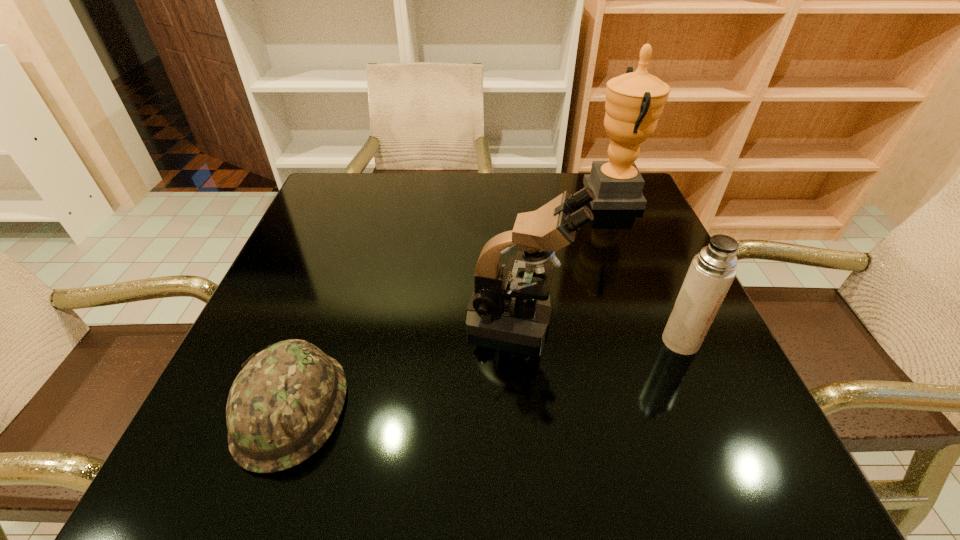
Locate an element on the screen. vacant space situated 0.060m on the front of the third shortest object is located at coordinates (524, 375).

In order to click on free space located 0.250m on the left of the thermos bottle in this screenshot , I will do `click(527, 341)`.

This screenshot has width=960, height=540. What are the coordinates of `vacant space situated on the left of the shortest object` in the screenshot? It's located at (205, 409).

This screenshot has height=540, width=960. I want to click on object at the far edge, so click(x=634, y=101).

This screenshot has width=960, height=540. Identify the location of object that is at the near edge. (284, 404).

Locate an element on the screen. object at the left edge is located at coordinates (284, 404).

This screenshot has height=540, width=960. I want to click on award that is at the right edge, so click(634, 101).

The width and height of the screenshot is (960, 540). Find the location of `thermos bottle that is at the right edge`. thermos bottle that is at the right edge is located at coordinates (712, 271).

The image size is (960, 540). In order to click on object located in the near left corner section of the desktop in this screenshot , I will do `click(284, 404)`.

Where is `object positioned at the far right corner`? object positioned at the far right corner is located at coordinates (634, 101).